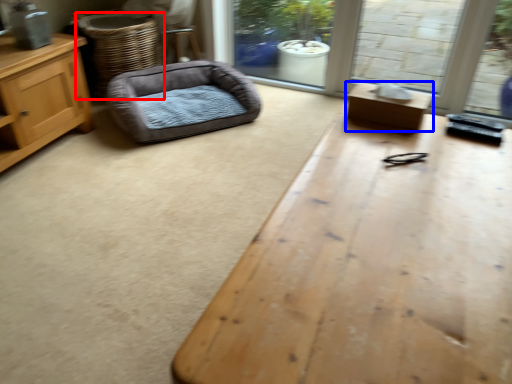
Question: Which point is closer to the camera, basket (highlighted by a red box) or table (highlighted by a blue box)?

Choices:
 (A) basket
 (B) table

Answer: (B)